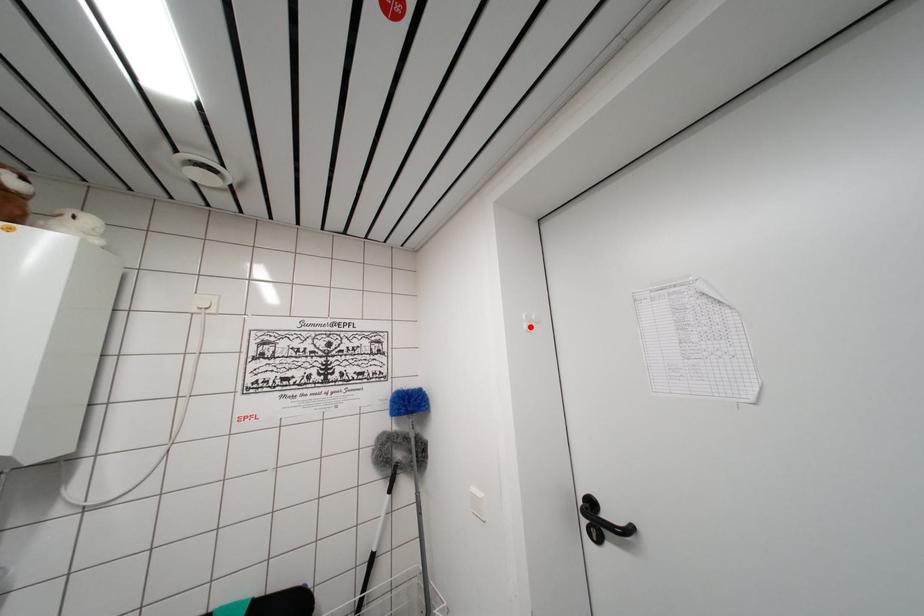
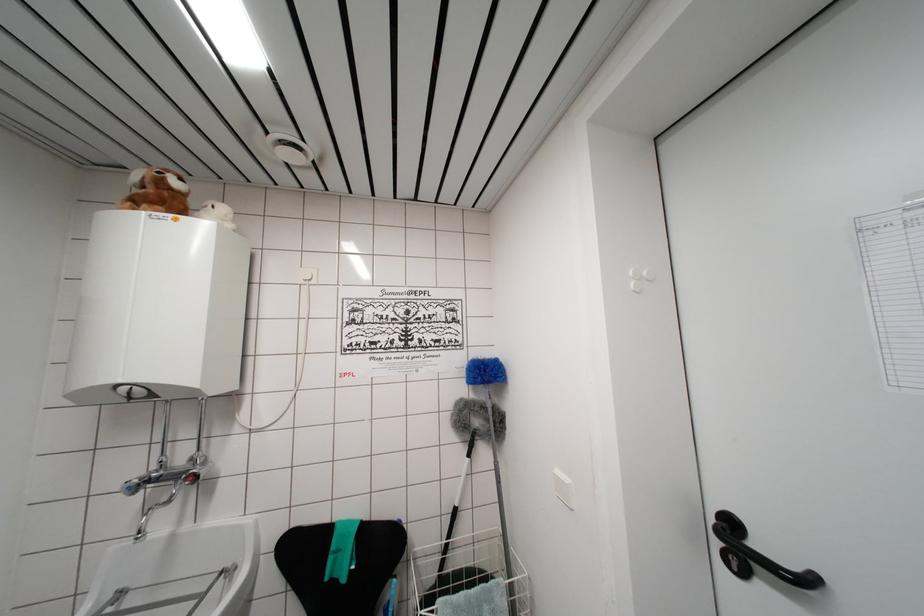
In the second image, find the point that corresponds to the highlighted location in the first image.

(638, 285)